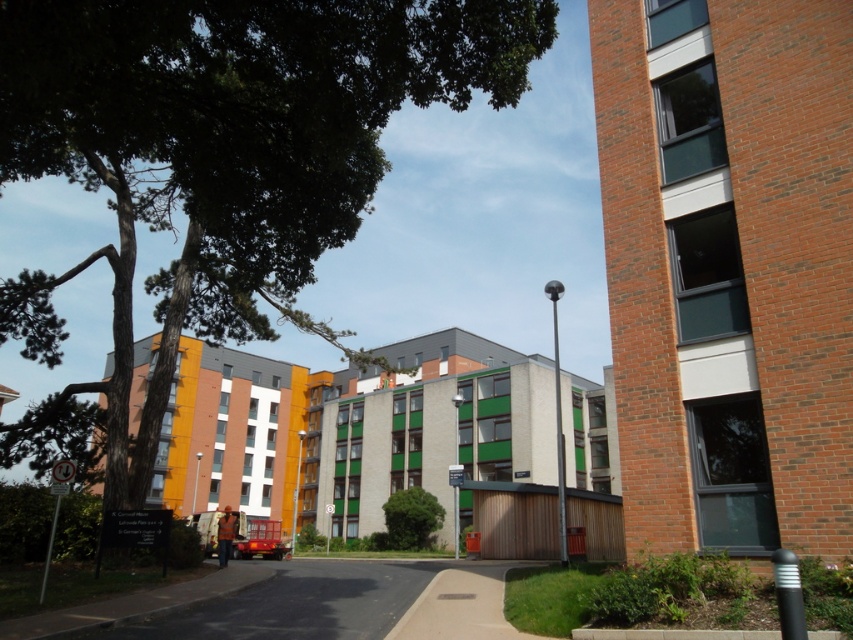
Question: Among these points, which one is nearest to the camera?

Choices:
 (A) (433, 524)
 (B) (215, 227)

Answer: (B)

Question: Can you confirm if green leafy tree at upper left is positioned above green leafy tree at center?

Choices:
 (A) yes
 (B) no

Answer: (A)

Question: Considering the relative positions of green leafy tree at upper left and green leafy tree at center in the image provided, where is green leafy tree at upper left located with respect to green leafy tree at center?

Choices:
 (A) right
 (B) left

Answer: (B)

Question: Can you confirm if green leafy tree at upper left is positioned above green leafy tree at center?

Choices:
 (A) no
 (B) yes

Answer: (B)

Question: Which of the following is the closest to the observer?

Choices:
 (A) green leafy tree at upper left
 (B) green leafy tree at center

Answer: (A)